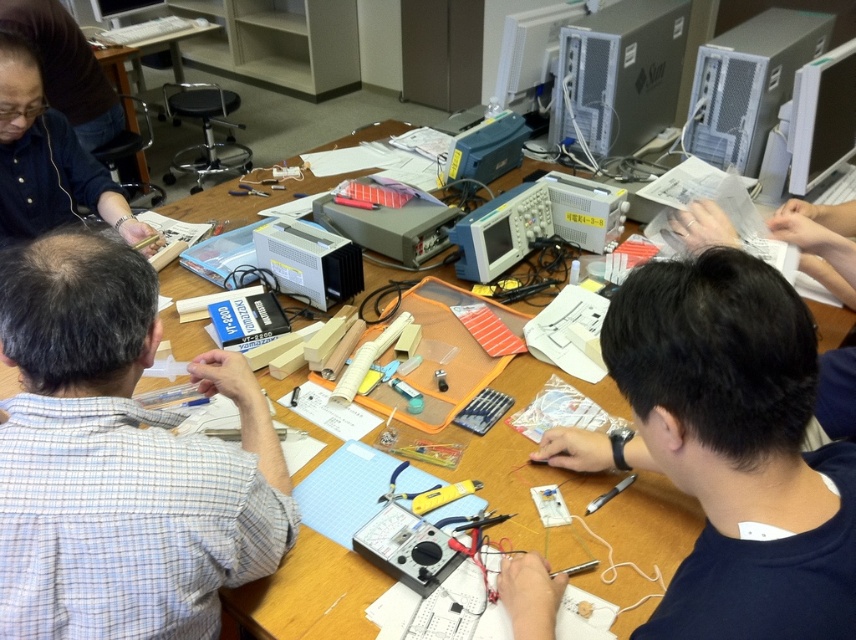
Question: Can you confirm if black matte shirt at center is positioned above wooden table at upper left?

Choices:
 (A) yes
 (B) no

Answer: (B)

Question: Observing the image, what is the correct spatial positioning of gray checkered shirt at left in reference to satin silver computer at upper center?

Choices:
 (A) right
 (B) left

Answer: (B)

Question: Which point is closer to the camera?

Choices:
 (A) gray metallic computer at upper right
 (B) gray checkered shirt at left
 (C) wooden table at upper left

Answer: (B)

Question: Observing the image, what is the correct spatial positioning of black matte shirt at center in reference to dark brown hair at upper right?

Choices:
 (A) below
 (B) above

Answer: (A)

Question: Which point is farther to the camera?

Choices:
 (A) brushed metal screwdriver at center
 (B) satin silver computer at upper center

Answer: (A)

Question: Which of the following is the farthest from the observer?

Choices:
 (A) (247, 189)
 (B) (36, 387)

Answer: (A)